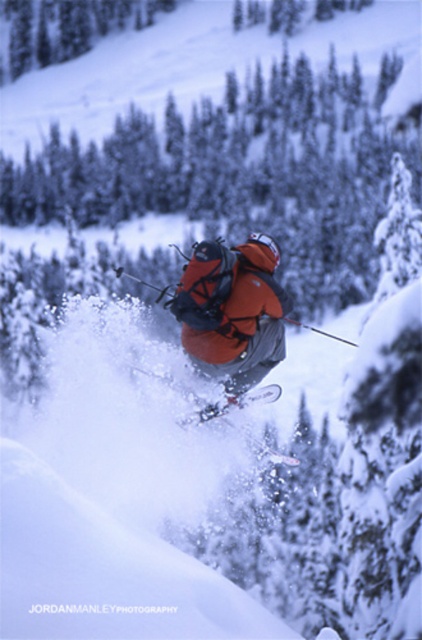
Which is more to the right, orange softshell jacket at center or white metallic ski at center?

Positioned to the right is white metallic ski at center.

Can you confirm if orange softshell jacket at center is bigger than white metallic ski at center?

Actually, orange softshell jacket at center might be smaller than white metallic ski at center.

Between point (222, 342) and point (202, 412), which one is positioned in front?

Positioned in front is point (222, 342).

Where is `orange softshell jacket at center`? orange softshell jacket at center is located at coordinates (240, 307).

Between point (273, 284) and point (276, 394), which one is positioned in front?

Point (273, 284) is in front.

Which is behind, point (267, 308) or point (207, 412)?

Positioned behind is point (207, 412).

The height and width of the screenshot is (640, 422). What are the coordinates of `orange softshell jacket at center` in the screenshot? It's located at (240, 307).

Can you confirm if white metallic ski at center is thinner than white matte skis at center?

In fact, white metallic ski at center might be wider than white matte skis at center.

Is point (260, 392) closer to viewer compared to point (235, 396)?

No, it is behind (235, 396).

Who is more forward, (278, 392) or (254, 396)?

Point (254, 396)

Locate an element on the screen. Image resolution: width=422 pixels, height=640 pixels. white metallic ski at center is located at coordinates (235, 403).